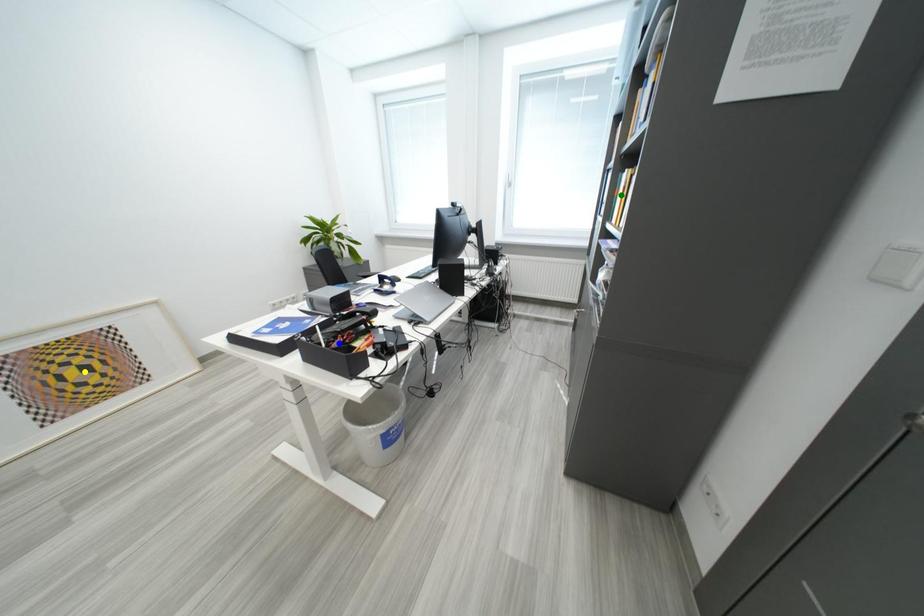
Order these from nearest to farthest:
green point | blue point | yellow point

blue point, yellow point, green point